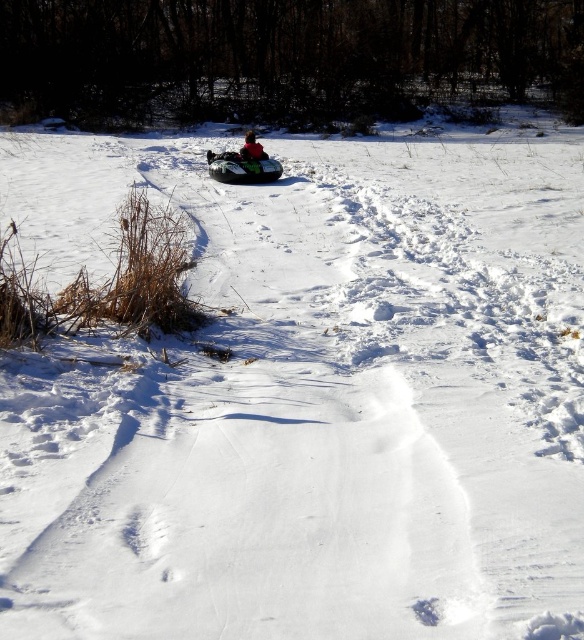
You are standing at the top of a snowy hill and see the green plastic snowmobile at center and the red matte jacket at center below you. Which object is closer to you?

The green plastic snowmobile at center is closer to you because it is in front of the red matte jacket at center, meaning it is positioned nearer to your viewpoint at the top of the hill.

You are trying to determine if the green plastic snowmobile at center can fit into a storage box that is the same size as the red matte jacket at center. Based on their sizes, will the snowmobile fit?

The green plastic snowmobile at center occupies less space than red matte jacket at center, so it will fit into the storage box.